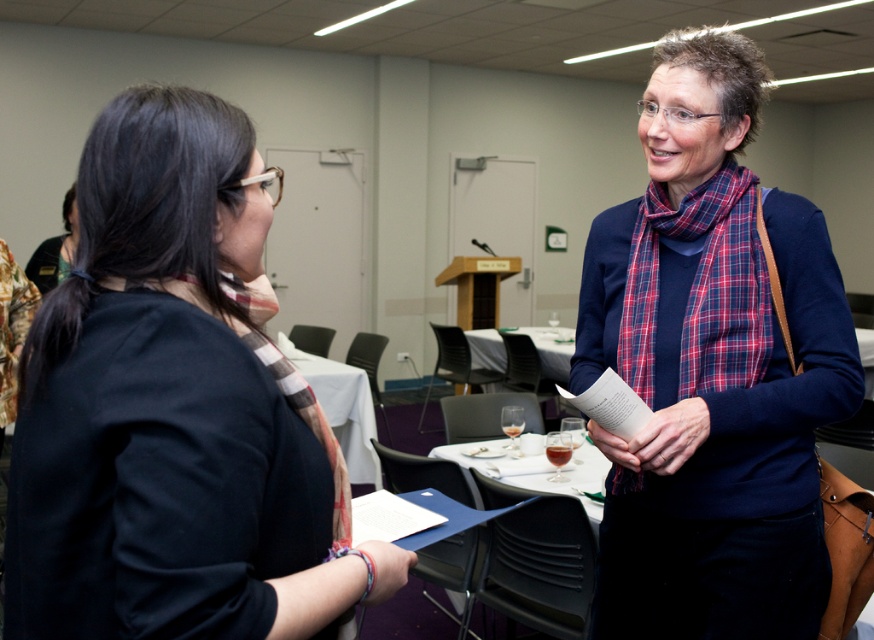
Question: Can you confirm if matte black shirt at left is bigger than white glossy table at center?

Choices:
 (A) no
 (B) yes

Answer: (A)

Question: Which point is farther to the camera?

Choices:
 (A) white glossy table at center
 (B) white clothed table at center

Answer: (A)

Question: Where is matte black shirt at left located in relation to blue sweater at center in the image?

Choices:
 (A) right
 (B) left

Answer: (B)

Question: Which point is closer to the camera?

Choices:
 (A) matte black shirt at left
 (B) white clothed table at center
 (C) white glossy table at center

Answer: (A)

Question: Is blue sweater at center to the left of white clothed table at center from the viewer's perspective?

Choices:
 (A) yes
 (B) no

Answer: (B)

Question: Which point is farther to the camera?

Choices:
 (A) (685, 342)
 (B) (349, 387)

Answer: (B)